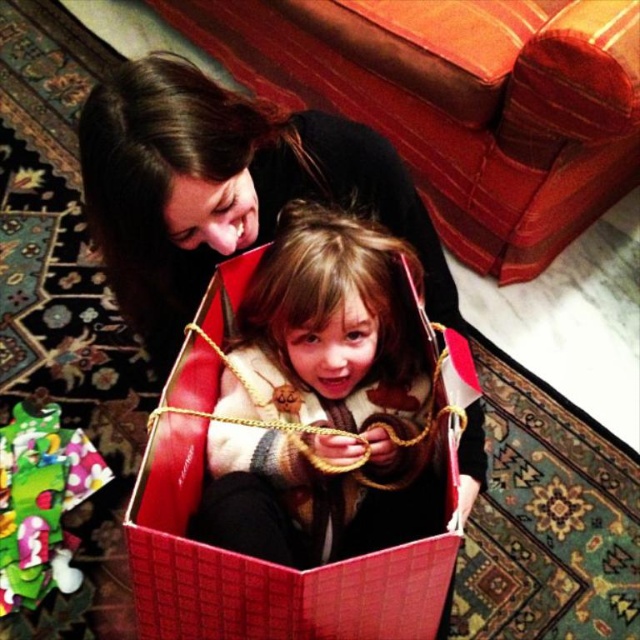
Question: Among these objects, which one is farthest from the camera?

Choices:
 (A) matte black sweater at upper left
 (B) plaid sweater at center

Answer: (B)

Question: Which point is closer to the camera taking this photo?

Choices:
 (A) (396, 269)
 (B) (250, 227)

Answer: (B)

Question: Where is plaid sweater at center located in relation to matte black sweater at upper left in the image?

Choices:
 (A) right
 (B) left

Answer: (A)

Question: Is plaid sweater at center thinner than matte black sweater at upper left?

Choices:
 (A) yes
 (B) no

Answer: (A)

Question: Is plaid sweater at center above matte black sweater at upper left?

Choices:
 (A) no
 (B) yes

Answer: (A)